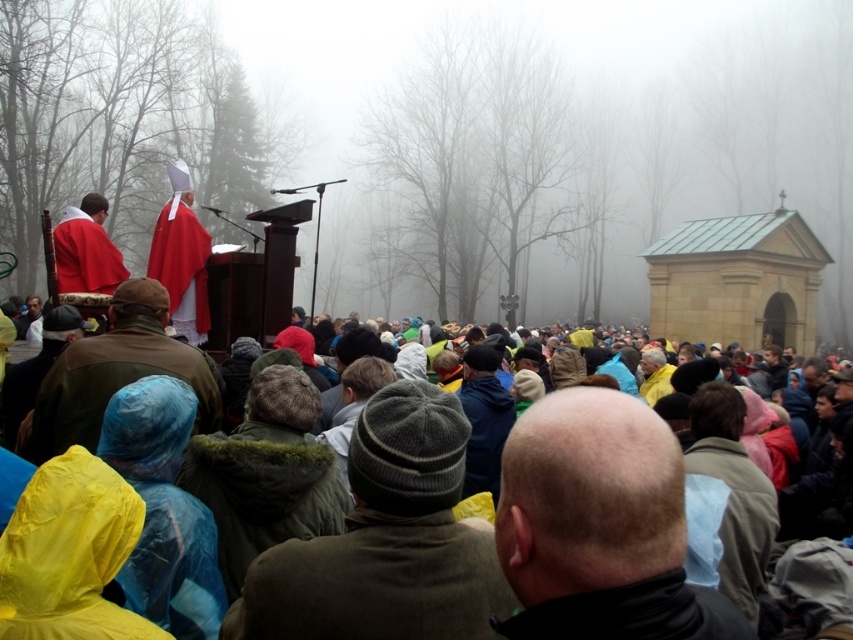
Question: Is brown woolen sweater at center to the right of matte red robe at center from the viewer's perspective?

Choices:
 (A) yes
 (B) no

Answer: (A)

Question: Does yellow raincoat at center appear on the left side of light blue fabric at center?

Choices:
 (A) no
 (B) yes

Answer: (B)

Question: Which of the following is the closest to the observer?

Choices:
 (A) (663, 545)
 (B) (305, 563)
 (C) (718, 465)

Answer: (A)

Question: Does brown woolen sweater at center have a greater width compared to light blue fabric at center?

Choices:
 (A) yes
 (B) no

Answer: (A)

Question: Which object is closer to the camera taking this photo?

Choices:
 (A) matte red robe at center
 (B) yellow raincoat at center

Answer: (B)

Question: Which point is closer to the camera?

Choices:
 (A) brown woolen sweater at center
 (B) yellow raincoat at center
 (C) matte red robe at center

Answer: (B)